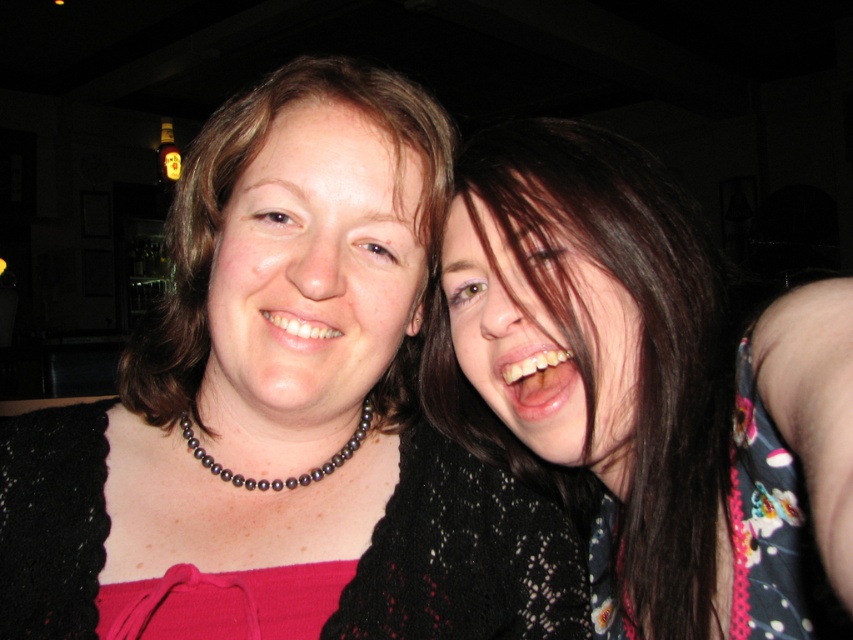
At what (x,y) coordinates should I click in order to perform the action: click on matte black necklace at upper left. Please return your answer as a coordinate pair (x, y). The height and width of the screenshot is (640, 853). Looking at the image, I should click on (283, 412).

Does matte black necklace at upper left appear on the right side of dark brown hair at upper right?

In fact, matte black necklace at upper left is to the left of dark brown hair at upper right.

Is point (288, 394) closer to camera compared to point (675, 528)?

Yes, it is in front of point (675, 528).

The height and width of the screenshot is (640, 853). Find the location of `matte black necklace at upper left`. matte black necklace at upper left is located at coordinates (283, 412).

Is matte black necklace at upper left wider than matte black necklace at center?

Incorrect, matte black necklace at upper left's width does not surpass matte black necklace at center's.

Is matte black necklace at upper left below matte black necklace at center?

Indeed, matte black necklace at upper left is positioned under matte black necklace at center.

Locate an element on the screen. This screenshot has width=853, height=640. matte black necklace at upper left is located at coordinates (283, 412).

Does dark brown hair at upper right have a greater height compared to matte black necklace at center?

Yes, dark brown hair at upper right is taller than matte black necklace at center.

Who is more distant from viewer, (631, 177) or (204, 362)?

Positioned behind is point (204, 362).

Where is `dark brown hair at upper right`? The height and width of the screenshot is (640, 853). dark brown hair at upper right is located at coordinates (643, 387).